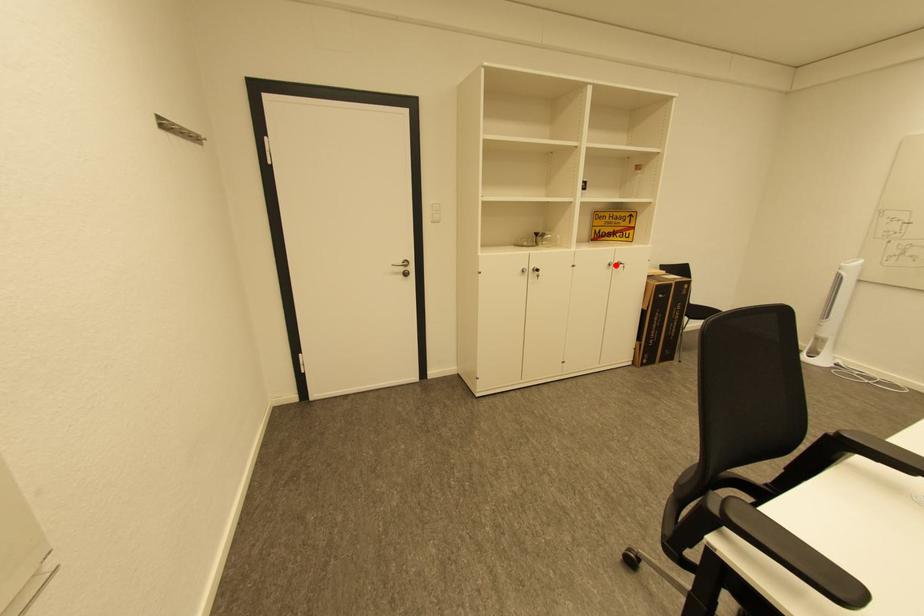
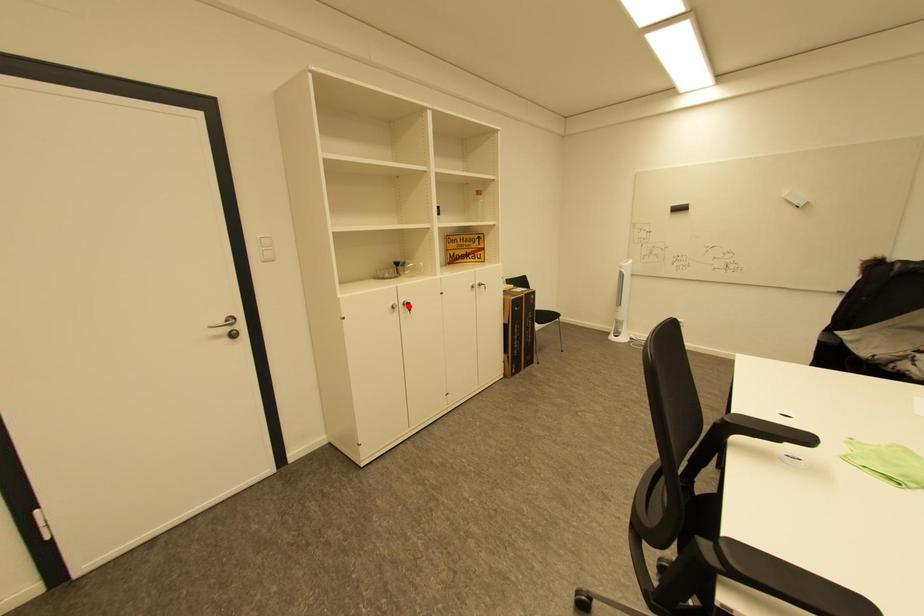
I am providing you with two images of the same scene from different viewpoints. A red point is marked on the first image and another point is marked on the second image. Do the highlighted points in image1 and image2 indicate the same real-world spot?

No